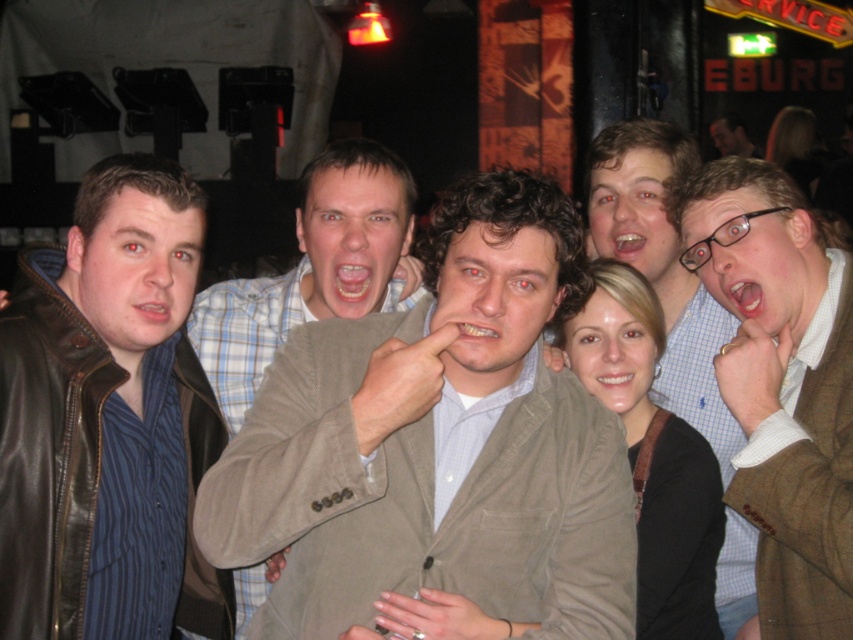
Question: Which object appears closest to the camera in this image?

Choices:
 (A) brown textured blazer at center
 (B) light brown leather jacket at upper right
 (C) leather jacket at left
 (D) brown textured blazer at upper right

Answer: (A)

Question: Among these objects, which one is nearest to the camera?

Choices:
 (A) leather jacket at left
 (B) brown textured blazer at center

Answer: (B)

Question: Does light brown textured blazer at center appear over light brown leather jacket at upper right?

Choices:
 (A) yes
 (B) no

Answer: (B)

Question: Is light brown textured blazer at center further to camera compared to brown textured blazer at upper right?

Choices:
 (A) no
 (B) yes

Answer: (A)

Question: Is brown textured blazer at center below brown textured blazer at upper right?

Choices:
 (A) no
 (B) yes

Answer: (B)

Question: Among these points, which one is farthest from the camera?

Choices:
 (A) (569, 477)
 (B) (788, 208)

Answer: (B)